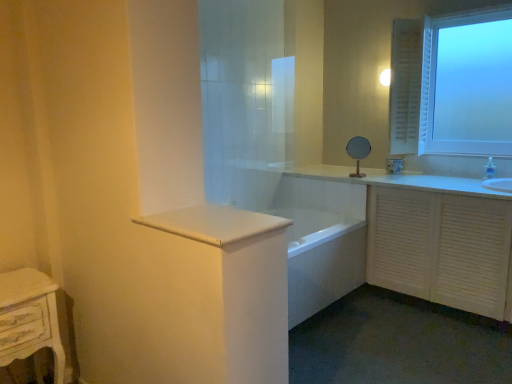
Question: Is white glossy countertop at center further to camera compared to white glossy bathtub at center?

Choices:
 (A) no
 (B) yes

Answer: (A)

Question: Would you say white glossy countertop at center is a long distance from white glossy bathtub at center?

Choices:
 (A) yes
 (B) no

Answer: (A)

Question: Is white glossy countertop at center not within white glossy bathtub at center?

Choices:
 (A) no
 (B) yes

Answer: (B)

Question: Considering the relative sizes of white glossy countertop at center and white glossy bathtub at center in the image provided, is white glossy countertop at center taller than white glossy bathtub at center?

Choices:
 (A) yes
 (B) no

Answer: (B)

Question: Can you confirm if white glossy countertop at center is thinner than white glossy bathtub at center?

Choices:
 (A) yes
 (B) no

Answer: (A)

Question: Relative to white glossy countertop at center, is frosted glass window at upper right in front or behind?

Choices:
 (A) front
 (B) behind

Answer: (B)

Question: Considering the relative positions of frosted glass window at upper right and white glossy countertop at center in the image provided, is frosted glass window at upper right to the left or to the right of white glossy countertop at center?

Choices:
 (A) left
 (B) right

Answer: (B)

Question: Is frosted glass window at upper right wider or thinner than white glossy countertop at center?

Choices:
 (A) thin
 (B) wide

Answer: (A)

Question: From a real-world perspective, is frosted glass window at upper right positioned above or below white glossy countertop at center?

Choices:
 (A) above
 (B) below

Answer: (A)

Question: In the image, is white distressed wood nightstand at lower left on the left side or the right side of white glossy bathtub at center?

Choices:
 (A) right
 (B) left

Answer: (B)

Question: Is white distressed wood nightstand at lower left in front of or behind white glossy bathtub at center in the image?

Choices:
 (A) behind
 (B) front

Answer: (B)

Question: From the image's perspective, is white distressed wood nightstand at lower left located above or below white glossy bathtub at center?

Choices:
 (A) above
 (B) below

Answer: (B)

Question: Is white distressed wood nightstand at lower left taller or shorter than white glossy bathtub at center?

Choices:
 (A) short
 (B) tall

Answer: (B)

Question: Is frosted glass window at upper right inside or outside of white distressed wood nightstand at lower left?

Choices:
 (A) outside
 (B) inside

Answer: (A)

Question: Based on their sizes in the image, would you say frosted glass window at upper right is bigger or smaller than white distressed wood nightstand at lower left?

Choices:
 (A) small
 (B) big

Answer: (B)